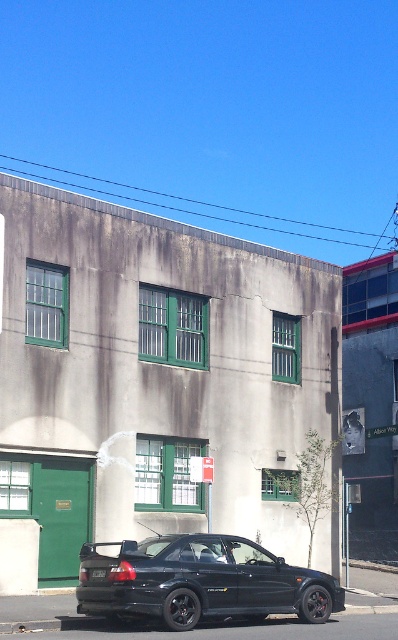
Does matte black car at lower center appear over black plastic license plate at center?

Incorrect, matte black car at lower center is not positioned above black plastic license plate at center.

Which is above, matte black car at lower center or black plastic license plate at center?

black plastic license plate at center is above.

Identify the location of matte black car at lower center. (200, 580).